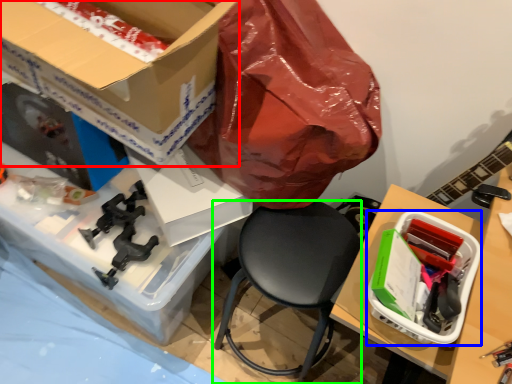
Question: Considering the real-world distances, which object is farthest from box (highlighted by a red box)? box (highlighted by a blue box) or chair (highlighted by a green box)?

Choices:
 (A) box
 (B) chair

Answer: (A)